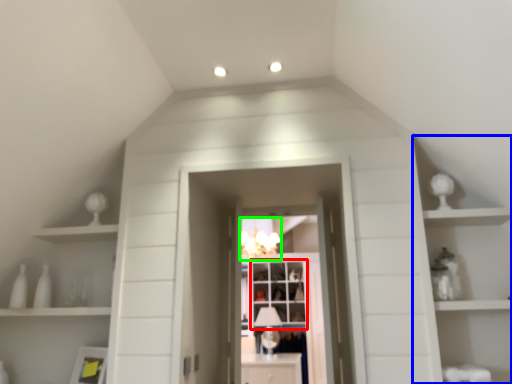
Question: Which object is the closest to the window (highlighted by a red box)? Choose among these: cabinet (highlighted by a blue box) or light fixture (highlighted by a green box).

Choices:
 (A) cabinet
 (B) light fixture

Answer: (B)